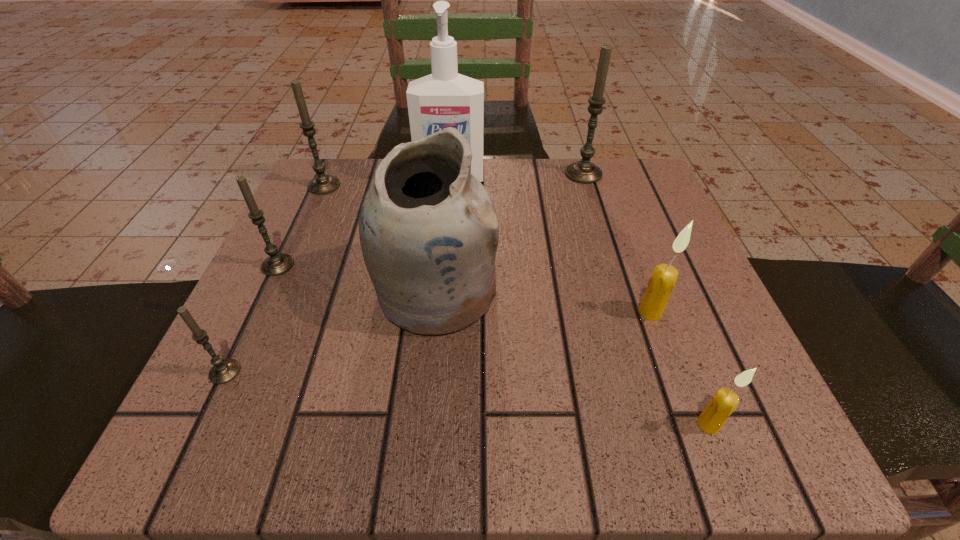
Locate an element on the screen. The width and height of the screenshot is (960, 540). vacant space at the far left corner of the desktop is located at coordinates 318,222.

The height and width of the screenshot is (540, 960). What are the coordinates of `vacant space at the near left corner of the desktop` in the screenshot? It's located at (217, 454).

The width and height of the screenshot is (960, 540). I want to click on vacant area at the near right corner, so click(667, 410).

Identify the location of vacant space that's between the tallest object and the smallest gray candle. This screenshot has width=960, height=540. (338, 276).

Locate an element on the screen. vacant area between the rightmost gray candle and the tallest object is located at coordinates (516, 177).

The height and width of the screenshot is (540, 960). What are the coordinates of `free spot between the pottery and the seventh farthest object` in the screenshot? It's located at (330, 331).

Where is `vacant area that lies between the nearest object and the tallest object`? The width and height of the screenshot is (960, 540). vacant area that lies between the nearest object and the tallest object is located at coordinates (580, 302).

Where is `vacant space that is in between the tallest object and the second nearest candle`? vacant space that is in between the tallest object and the second nearest candle is located at coordinates (338, 276).

Locate an element on the screen. free spot between the rightmost gray candle and the cleansing agent is located at coordinates (516, 177).

The height and width of the screenshot is (540, 960). Find the location of `free space between the pottery and the bigger cream candle`. free space between the pottery and the bigger cream candle is located at coordinates (542, 301).